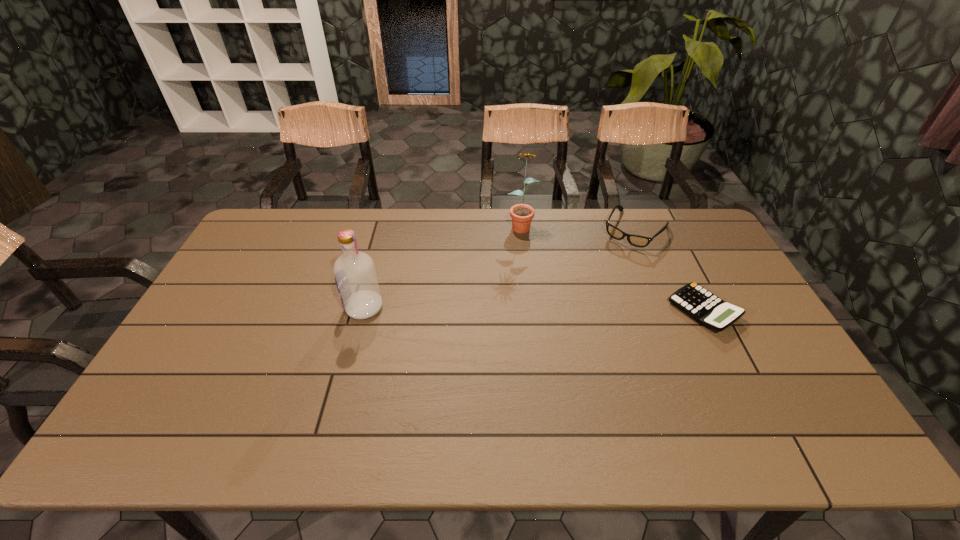
Identify the location of vacant region located on the front-facing side of the third tallest object. This screenshot has width=960, height=540. (590, 292).

Locate an element on the screen. The image size is (960, 540). vacant area situated 0.230m on the flower of the sunflower is located at coordinates (516, 280).

In order to click on vacant area located 0.100m on the flower of the sunflower in this screenshot , I will do `click(519, 253)`.

This screenshot has width=960, height=540. Find the location of `vacant space positioned on the flower of the sunflower`. vacant space positioned on the flower of the sunflower is located at coordinates (518, 257).

Find the location of a particular element. spectacles situated at the far edge is located at coordinates (635, 240).

Locate an element on the screen. This screenshot has height=540, width=960. sunflower that is positioned at the far edge is located at coordinates (522, 214).

Find the location of `calculator positioned at the right edge`. calculator positioned at the right edge is located at coordinates (703, 306).

The image size is (960, 540). Find the location of `spectacles positioned at the right edge`. spectacles positioned at the right edge is located at coordinates (635, 240).

Where is `object at the far right corner`? The image size is (960, 540). object at the far right corner is located at coordinates (635, 240).

Locate an element on the screen. vacant space at the far edge is located at coordinates (289, 249).